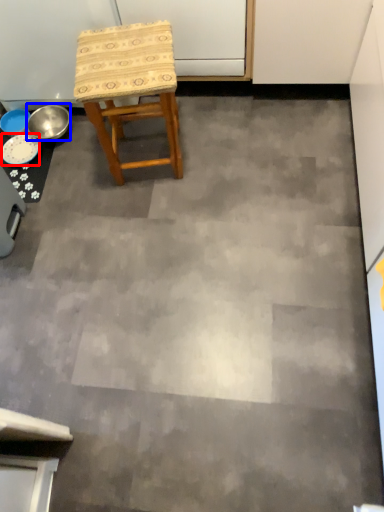
Question: Which object appears farthest to the camera in this image, plate (highlighted by a red box) or bowl (highlighted by a blue box)?

Choices:
 (A) plate
 (B) bowl

Answer: (B)